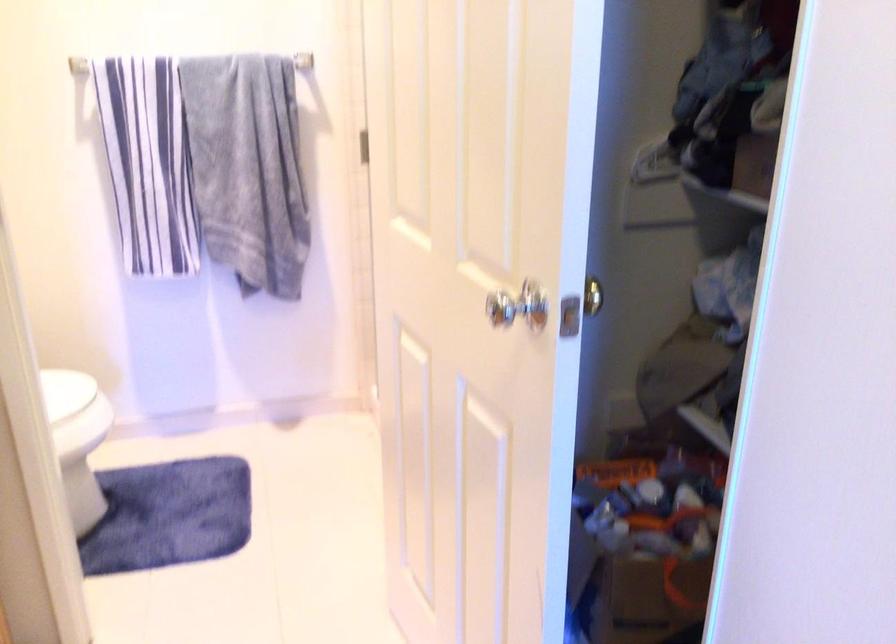
Image resolution: width=896 pixels, height=644 pixels. What do you see at coordinates (518, 307) in the screenshot?
I see `a silver door knob` at bounding box center [518, 307].